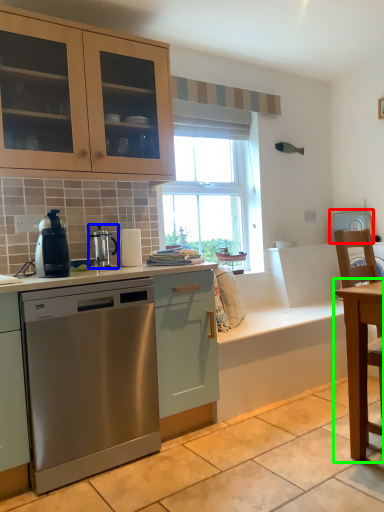
Question: Which object is positioned closest to appliance (highlighted by a red box)? Select from kitchen appliance (highlighted by a blue box) and table (highlighted by a green box).

Choices:
 (A) kitchen appliance
 (B) table

Answer: (B)